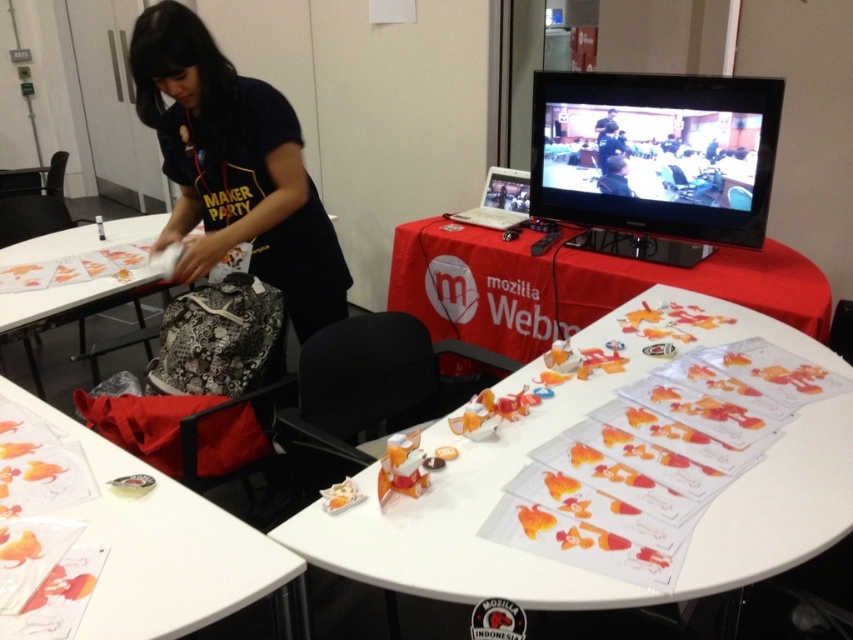
Does red cloth at upper center have a lesser width compared to matte plastic table at lower left?

No, red cloth at upper center is not thinner than matte plastic table at lower left.

Locate an element on the screen. red cloth at upper center is located at coordinates (573, 284).

Describe the element at coordinates (573, 284) in the screenshot. I see `red cloth at upper center` at that location.

Find the location of a particular element. This screenshot has height=640, width=853. red cloth at upper center is located at coordinates (573, 284).

Does point (759, 330) come behind point (137, 291)?

No, (759, 330) is in front of (137, 291).

Which is in front, point (466, 563) or point (142, 285)?

Positioned in front is point (466, 563).

Between point (524, 556) and point (25, 292), which one is positioned behind?

The point (25, 292) is more distant.

Identify the location of white paper at center. The image size is (853, 640). (503, 481).

Is white paper at center positioned before matte plastic table at lower left?

No, white paper at center is further to the viewer.

Does white paper at center appear on the right side of matte plastic table at lower left?

Correct, you'll find white paper at center to the right of matte plastic table at lower left.

Who is more forward, (358,564) or (172,481)?

Positioned in front is point (358,564).

Find the location of a particular element. The height and width of the screenshot is (640, 853). white paper at center is located at coordinates (503, 481).